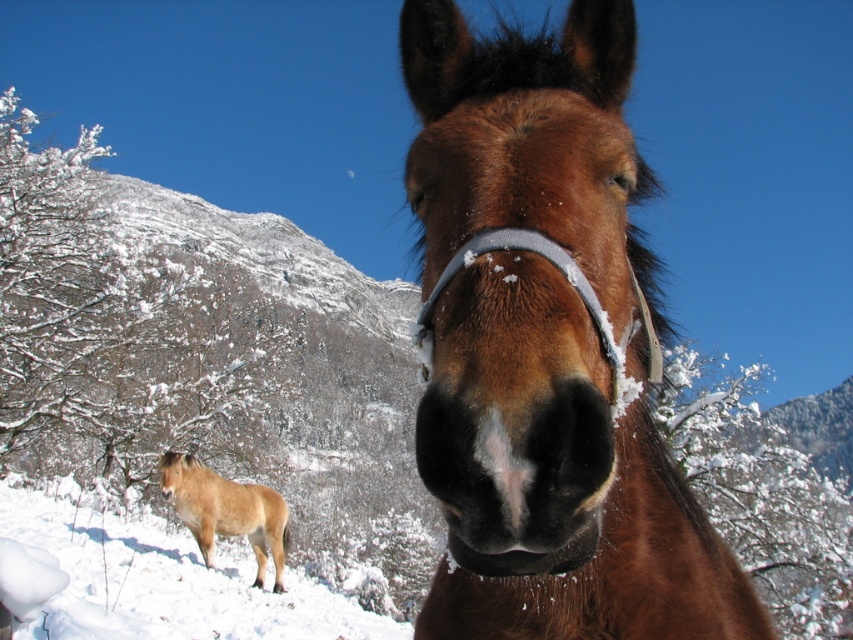
Does brown glossy horse at center have a lesser height compared to light brown fur pony at lower left?

No, brown glossy horse at center is not shorter than light brown fur pony at lower left.

Locate an element on the screen. brown glossy horse at center is located at coordinates click(x=546, y=346).

Is point (448, 528) more distant than point (239, 516)?

No, it is in front of (239, 516).

Locate an element on the screen. brown glossy horse at center is located at coordinates (546, 346).